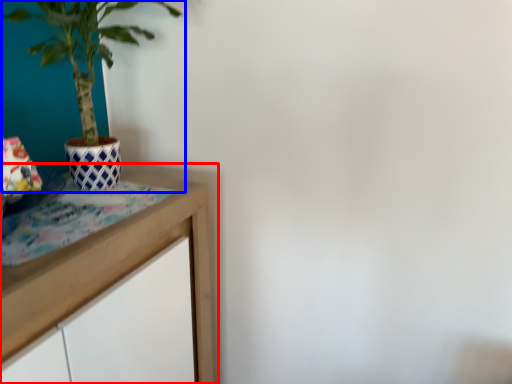
Question: Which object appears closest to the camera in this image, table (highlighted by a red box) or houseplant (highlighted by a blue box)?

Choices:
 (A) table
 (B) houseplant

Answer: (A)